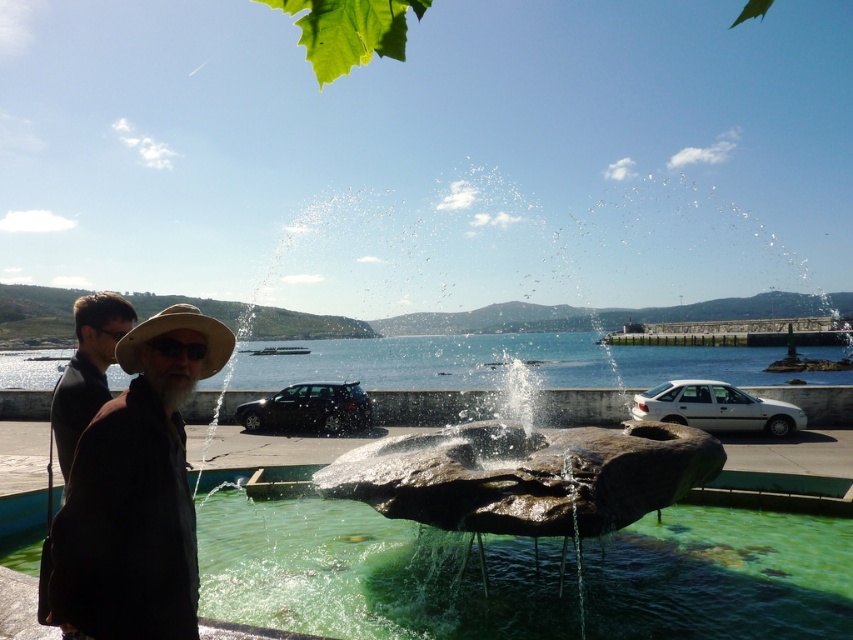
You are standing at the point marked as point [136,492] in the image. What object are you touching?

The point [136,492] is on the brown leather jacket at left, so you are touching the brown leather jacket at left.

You are a photographer standing in front of the green stone water at center and the brown leather jacket at left. You want to take a photo that includes both elements. Which object should you position closer to the camera to ensure both are in focus?

To ensure both the green stone water at center and the brown leather jacket at left are in focus, you should position the brown leather jacket at left closer to the camera since it is currently behind the green stone water at center.